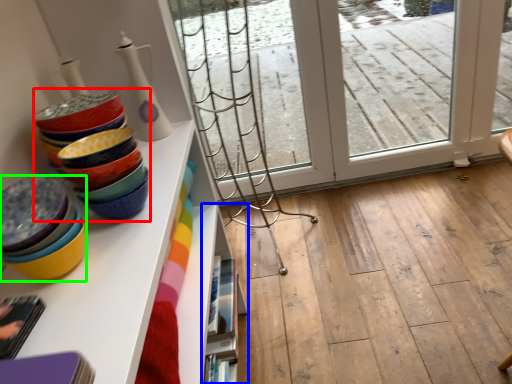
Question: Which object is the closest to the tableware (highlighted by a red box)? Choose among these: shelf (highlighted by a blue box) or table (highlighted by a green box).

Choices:
 (A) shelf
 (B) table

Answer: (B)